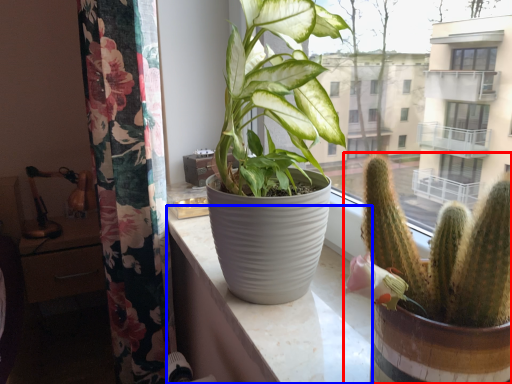
Question: Which object appears farthest to the camera in this image, houseplant (highlighted by a red box) or counter top (highlighted by a blue box)?

Choices:
 (A) houseplant
 (B) counter top

Answer: (B)